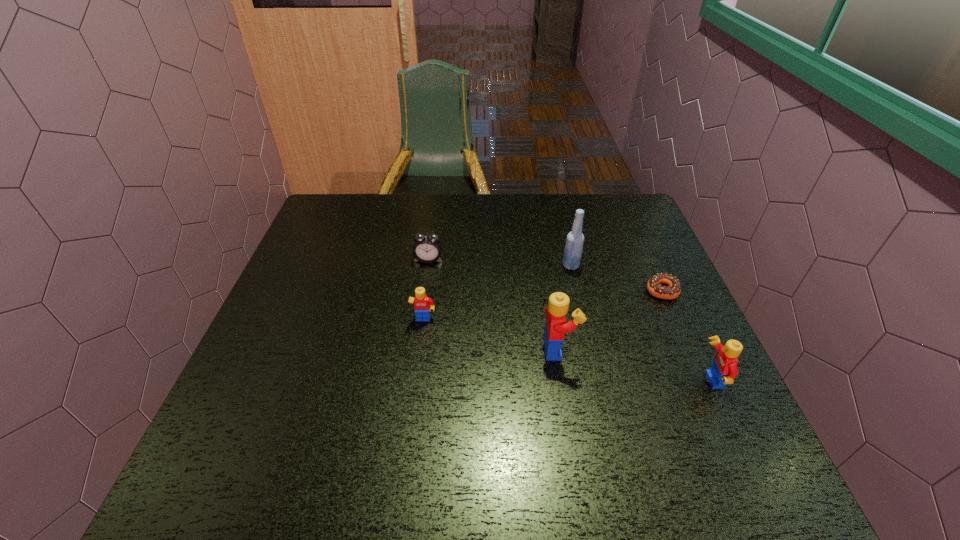
In the current image, all Legos are evenly spaced. To maintain this equal spacing, where should an additional Lego be placed on the left? Please point out a free spot. Please provide its 2D coordinates. Your answer should be formatted as a tuple, i.e. [(x, y)], where the tuple contains the x and y coordinates of a point satisfying the conditions above.

[(305, 295)]